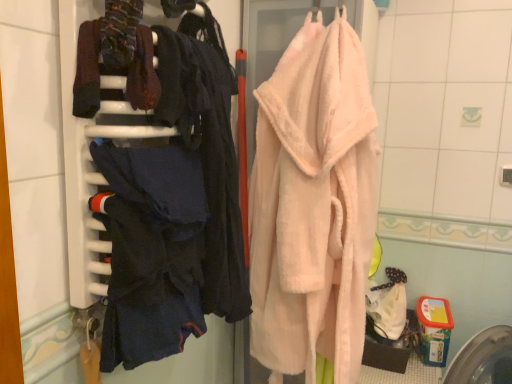
The height and width of the screenshot is (384, 512). What do you see at coordinates (152, 251) in the screenshot?
I see `dark blue fabric at left` at bounding box center [152, 251].

The width and height of the screenshot is (512, 384). What do you see at coordinates (312, 208) in the screenshot?
I see `soft pink plush bathrobe at center` at bounding box center [312, 208].

You are a GUI agent. You are given a task and a screenshot of the screen. Output one action in this format:
    pyautogui.click(x=<x>, y=<y>)
    Task: Click on the dark blue fabric at left
    The width and height of the screenshot is (512, 384).
    Given the screenshot: What is the action you would take?
    pyautogui.click(x=154, y=197)

Where is `dark blue fabric at left`? The image size is (512, 384). dark blue fabric at left is located at coordinates (152, 251).

Find the location of a particular element. Image resolution: width=512 pixels, height=384 pixels. closet lying above the soft pink plush bathrobe at center (from the image's perspective) is located at coordinates (154, 197).

Considering the positions of objects soft pink plush bathrobe at center and dark blue fabric at left in the image provided, who is more to the right, soft pink plush bathrobe at center or dark blue fabric at left?

soft pink plush bathrobe at center.

Considering the sizes of objects soft pink plush bathrobe at center and dark blue fabric at left in the image provided, who is smaller, soft pink plush bathrobe at center or dark blue fabric at left?

Smaller between the two is dark blue fabric at left.

Considering the relative positions of soft pink plush bathrobe at center and dark blue fabric at left in the image provided, is soft pink plush bathrobe at center in front of dark blue fabric at left?

No.

Can you tell me how much soft pink plush bathrobe at center and dark blue fabric at left differ in facing direction?

The angular difference between soft pink plush bathrobe at center and dark blue fabric at left is 92.5 degrees.

In the image, there is a dark blue fabric at left. What are the coordinates of `towel above it (from the image's perspective)` in the screenshot? It's located at (312, 208).

Which object is wider, soft pink plush bathrobe at center or dark blue fabric at left?

soft pink plush bathrobe at center is wider.

Are dark blue fabric at left and dark blue fabric at left beside each other?

Absolutely, dark blue fabric at left is next to and touching dark blue fabric at left.

Do you think dark blue fabric at left is within dark blue fabric at left, or outside of it?

dark blue fabric at left exists outside the volume of dark blue fabric at left.

From a real-world perspective, is dark blue fabric at left positioned over dark blue fabric at left based on gravity?

Yes.

Between dark blue fabric at left and dark blue fabric at left, which one has larger width?

dark blue fabric at left.

Is dark blue fabric at left looking in the opposite direction of soft pink plush bathrobe at center?

No, dark blue fabric at left is not facing the opposite direction of soft pink plush bathrobe at center.

Is dark blue fabric at left at the right side of soft pink plush bathrobe at center?

No.

Is dark blue fabric at left positioned in front of soft pink plush bathrobe at center?

Result: Yes, dark blue fabric at left is closer to the viewer.

Can you confirm if dark blue fabric at left is wider than soft pink plush bathrobe at center?

In fact, dark blue fabric at left might be narrower than soft pink plush bathrobe at center.

From the picture: Is dark blue fabric at left oriented away from soft pink plush bathrobe at center?

No, dark blue fabric at left's orientation is not away from soft pink plush bathrobe at center.

Is dark blue fabric at left situated inside soft pink plush bathrobe at center or outside?

dark blue fabric at left is spatially situated outside soft pink plush bathrobe at center.

Between dark blue fabric at left and soft pink plush bathrobe at center, which one has less height?

dark blue fabric at left is shorter.

Does dark blue fabric at left have a lesser width compared to soft pink plush bathrobe at center?

Yes, dark blue fabric at left is thinner than soft pink plush bathrobe at center.

From a real-world perspective, is dark blue fabric at left physically above dark blue fabric at left?

No, from a real-world perspective, dark blue fabric at left is not over dark blue fabric at left

The height and width of the screenshot is (384, 512). Identify the location of clothing behind the dark blue fabric at left. (152, 251).

Is dark blue fabric at left facing away from dark blue fabric at left?

Yes, dark blue fabric at left is facing away from dark blue fabric at left.

Considering the relative positions of dark blue fabric at left and dark blue fabric at left in the image provided, is dark blue fabric at left in front of dark blue fabric at left?

No, it is behind dark blue fabric at left.

This screenshot has width=512, height=384. Find the location of `closet lying above the soft pink plush bathrobe at center (from the image's perspective)`. closet lying above the soft pink plush bathrobe at center (from the image's perspective) is located at coordinates (154, 197).

This screenshot has height=384, width=512. I want to click on towel behind the dark blue fabric at left, so click(x=312, y=208).

From the image, which object appears to be nearer to soft pink plush bathrobe at center, dark blue fabric at left or dark blue fabric at left?

dark blue fabric at left lies closer to soft pink plush bathrobe at center than the other object.

When comparing their distances from soft pink plush bathrobe at center, does dark blue fabric at left or dark blue fabric at left seem further?

dark blue fabric at left lies further to soft pink plush bathrobe at center than the other object.

Which object lies further to the anchor point dark blue fabric at left, dark blue fabric at left or soft pink plush bathrobe at center?

soft pink plush bathrobe at center.

Which object lies nearer to the anchor point dark blue fabric at left, soft pink plush bathrobe at center or dark blue fabric at left?

The object closer to dark blue fabric at left is dark blue fabric at left.

Looking at the image, which one is located further to dark blue fabric at left, soft pink plush bathrobe at center or dark blue fabric at left?

soft pink plush bathrobe at center lies further to dark blue fabric at left than the other object.

From the picture: Which object lies nearer to the anchor point dark blue fabric at left, dark blue fabric at left or soft pink plush bathrobe at center?

dark blue fabric at left is closer to dark blue fabric at left.

Find the location of a particular element. The height and width of the screenshot is (384, 512). clothing between dark blue fabric at left and soft pink plush bathrobe at center from left to right is located at coordinates point(152,251).